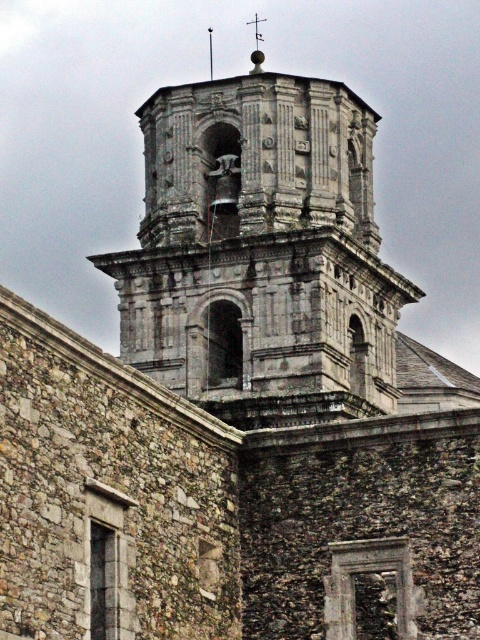
Consider the image. Does stone bell tower at center have a lesser height compared to polished silver spire at upper center?

Yes, stone bell tower at center is shorter than polished silver spire at upper center.

Does stone bell tower at center appear on the right side of polished silver spire at upper center?

Indeed, stone bell tower at center is positioned on the right side of polished silver spire at upper center.

Does point (132, 360) come farther from viewer compared to point (257, 29)?

No.

Find the location of `stone bell tower at center`. stone bell tower at center is located at coordinates (261, 252).